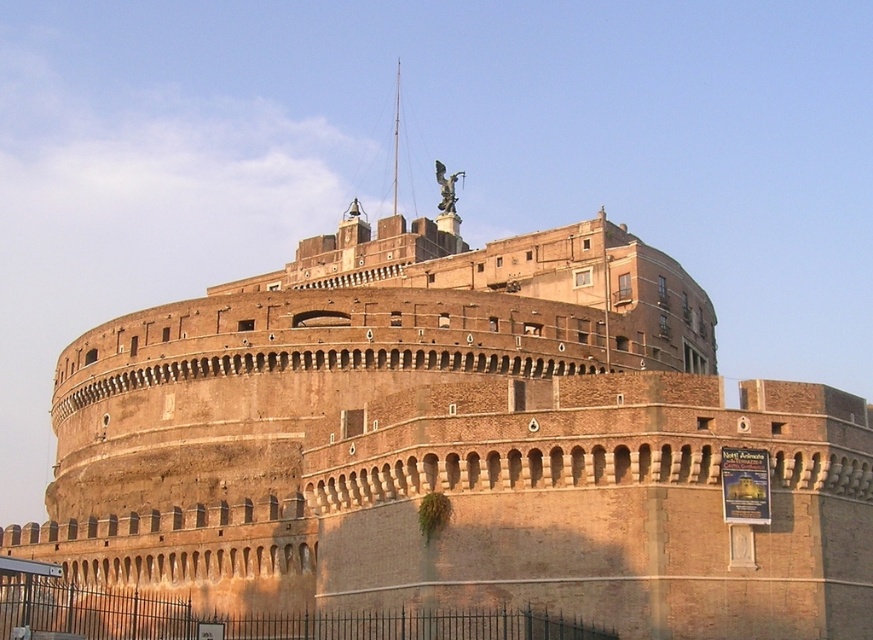
Question: Does black wrought iron fence at lower center have a lesser width compared to bronze statue at upper center?

Choices:
 (A) yes
 (B) no

Answer: (B)

Question: Which point is closer to the camera?

Choices:
 (A) (19, 612)
 (B) (445, 205)

Answer: (A)

Question: Among these objects, which one is farthest from the camera?

Choices:
 (A) black wrought iron fence at lower center
 (B) bronze statue at upper center

Answer: (B)

Question: Does black wrought iron fence at lower center appear under bronze statue at upper center?

Choices:
 (A) no
 (B) yes

Answer: (B)

Question: Which of the following is the closest to the observer?

Choices:
 (A) (97, 616)
 (B) (434, 170)

Answer: (A)

Question: Is black wrought iron fence at lower center bigger than bronze statue at upper center?

Choices:
 (A) no
 (B) yes

Answer: (B)